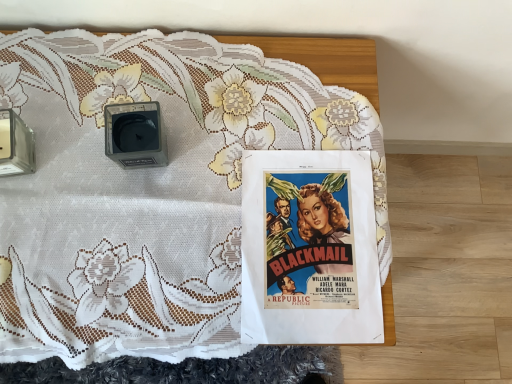
The image size is (512, 384). Find the location of `free spot in front of matte black alarm clock at upper left`. free spot in front of matte black alarm clock at upper left is located at coordinates (121, 244).